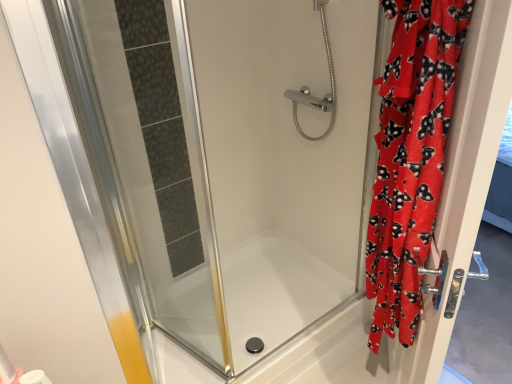
Question: From the image's perspective, is white matte toilet paper at lower left located above or below velvet red robe at right, which is the second screen door in left-to-right order?

Choices:
 (A) below
 (B) above

Answer: (A)

Question: Is white matte toilet paper at lower left taller or shorter than velvet red robe at right, which appears as the first screen door when viewed from the right?

Choices:
 (A) short
 (B) tall

Answer: (A)

Question: Estimate the real-world distances between objects in this image. Which object is farther from the red velvet curtain at right?

Choices:
 (A) velvet red robe at right, which is the second screen door in left-to-right order
 (B) transparent glass shower door at left, the second screen door from the right
 (C) transparent glass bathtub at center
 (D) white matte toilet paper at lower left
 (E) chrome metallic showerhead at upper center

Answer: (D)

Question: Which object is the closest to the velvet red robe at right, which appears as the first screen door when viewed from the right?

Choices:
 (A) transparent glass shower door at left, which ranks as the 1th screen door in left-to-right order
 (B) transparent glass bathtub at center
 (C) chrome metallic showerhead at upper center
 (D) red velvet curtain at right
 (E) white matte toilet paper at lower left

Answer: (D)